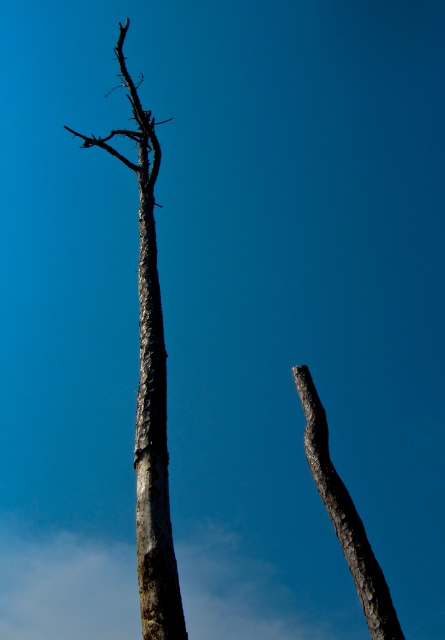
You are standing at the center of the image and want to find the smooth bark tree trunk at center. According to the coordinates provided, in which direction should you look to locate it?

The smooth bark tree trunk at center is located at coordinates point [153,451], which means you should look to the lower right direction from the center to find it.

You are standing at the center of the image and want to locate the gray textured trunk at center. Which direction should you look to find it?

The gray textured trunk at center is located at point coordinates of (149, 387), so you should look to the right and slightly upward to find it.

You are an arborist inspecting two trees in a park. You notice the smooth bark tree trunk at center and the gray rough bark branch at center. Which of these has a smaller size?

The smooth bark tree trunk at center is smaller than the gray rough bark branch at center.